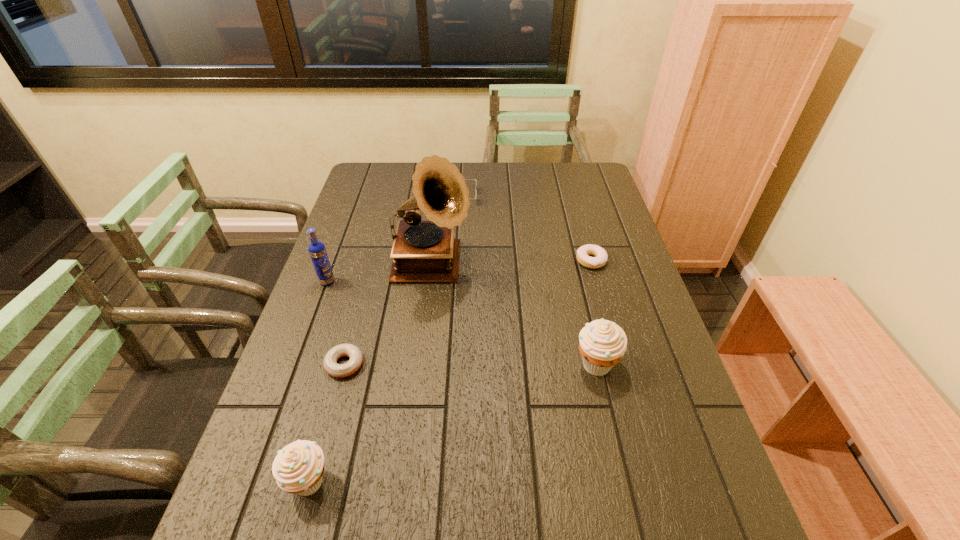
Where is `free space for an extra muffin to achieve even spacing`? Image resolution: width=960 pixels, height=540 pixels. free space for an extra muffin to achieve even spacing is located at coordinates (468, 417).